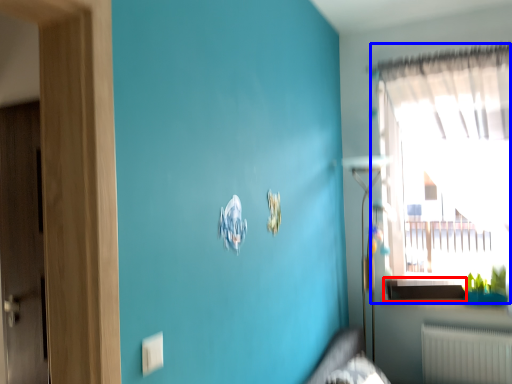
Question: Which object is closer to the camera taking this photo, window sill (highlighted by a red box) or window (highlighted by a blue box)?

Choices:
 (A) window sill
 (B) window

Answer: (B)